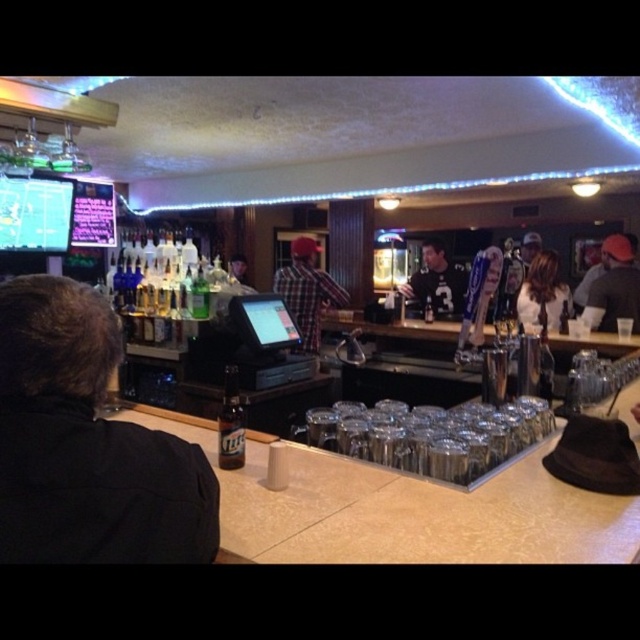
From the picture: You are a bartender and need to place a new bottle of wine between the matte black shirt at center and the clear glass bottle at bar center. Based on their sizes, which object should you place the wine bottle closer to?

The wine bottle should be placed closer to the clear glass bottle at bar center because the matte black shirt at center is wider, leaving less space between them compared to the space between the clear glass bottle at bar center and the shirt.

You are a bartender at the bar counter. You need to place a new drink order between the two points on the counter, point (435, 244) and point (230, 467). Since you want the order to be closer to the customer seated at the bar, which point should you place it closer to?

You should place the new drink order closer to point (435, 244) because it is closer to the customer. Since the customer is seated facing away from the camera, the point closer to them would be the one further towards the front of the bar counter. According to the description, point (435, 244) is further to the camera than point (230, 467). Wait, this seems contradictory. Let me think again. If point A is further to the camera than point B, then point B is closer to the customer who is facing away. So